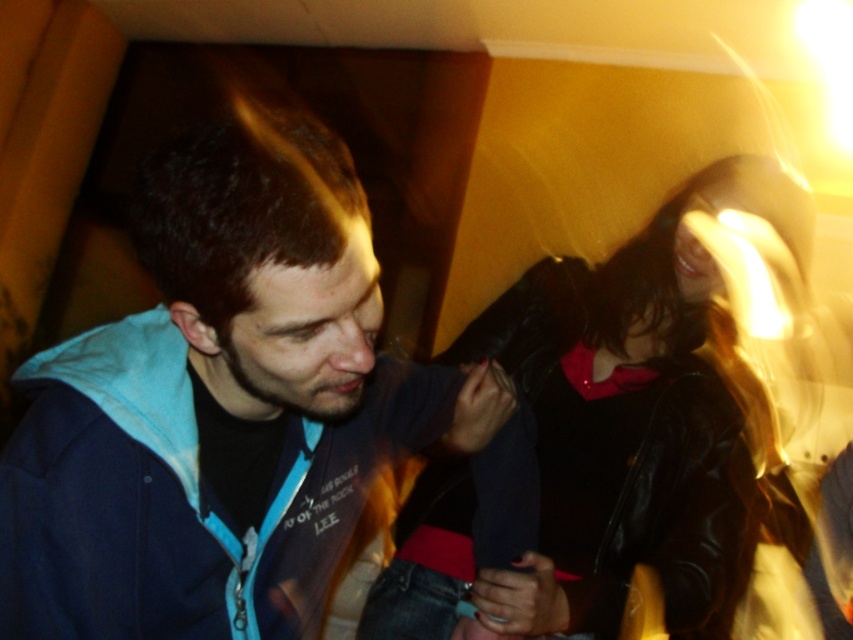
Question: Which of the following is the closest to the observer?

Choices:
 (A) (790, 180)
 (B) (260, 179)

Answer: (B)

Question: Is blue zip-up hoodie at center to the right of shiny black jacket at center from the viewer's perspective?

Choices:
 (A) yes
 (B) no

Answer: (B)

Question: Does blue zip-up hoodie at center have a lesser width compared to shiny black jacket at center?

Choices:
 (A) yes
 (B) no

Answer: (A)

Question: Does blue zip-up hoodie at center appear on the left side of shiny black jacket at center?

Choices:
 (A) no
 (B) yes

Answer: (B)